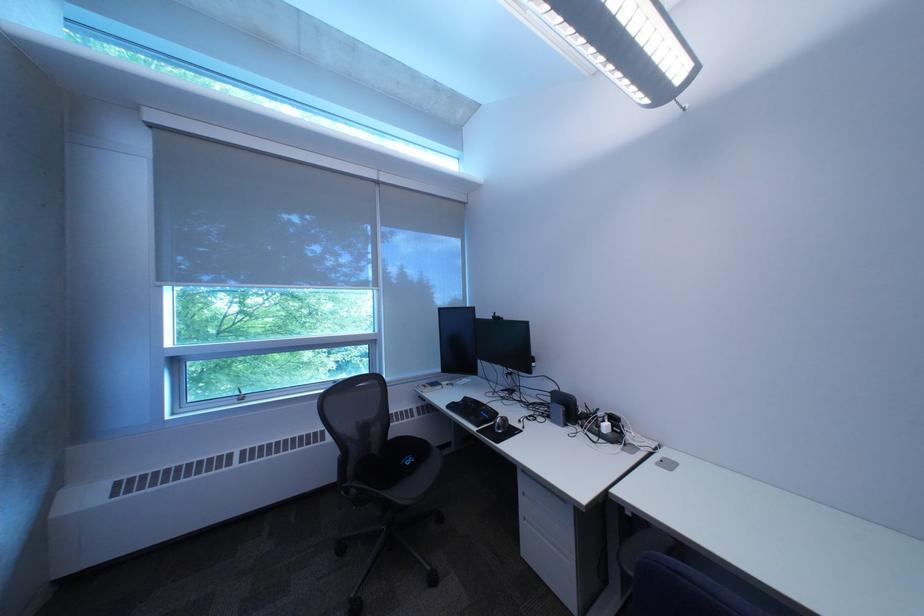
The width and height of the screenshot is (924, 616). Find the location of `black computer keyboard`. black computer keyboard is located at coordinates 472,411.